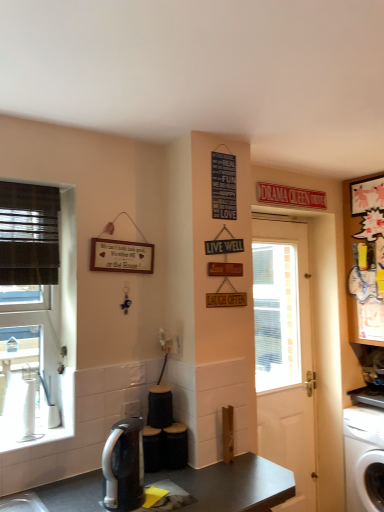
Locate an element on the screen. The image size is (384, 512). free space above dark gray laminate desk at center (from a real-world perspective) is located at coordinates (188, 482).